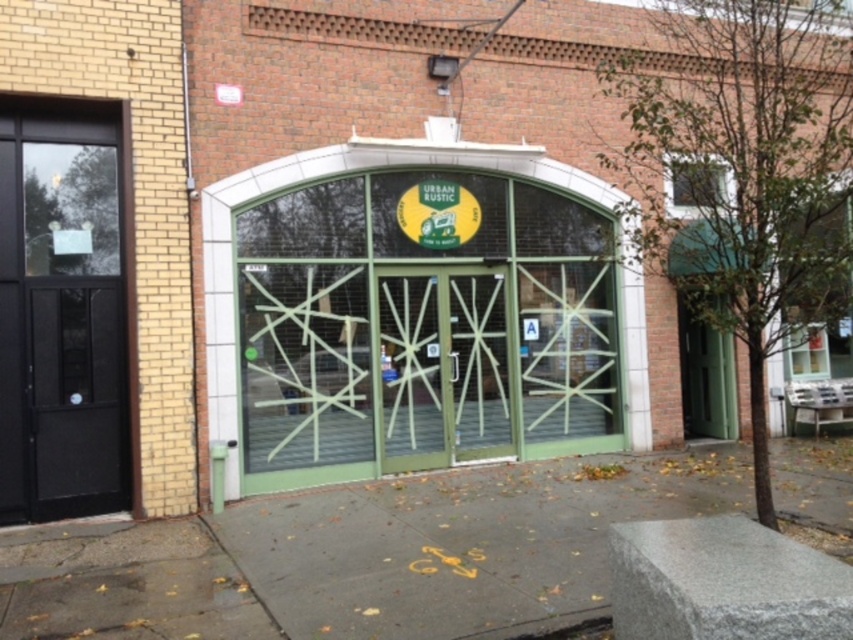
Which of these two, green matte glass door at center or black glass door at left, stands taller?

Standing taller between the two is black glass door at left.

Is point (286, 280) positioned in front of point (67, 173)?

No.

Describe the element at coordinates (418, 314) in the screenshot. This screenshot has height=640, width=853. I see `green matte glass door at center` at that location.

The image size is (853, 640). Find the location of `green matte glass door at center`. green matte glass door at center is located at coordinates (418, 314).

Which of these two, green matte glass door at center or gray concrete sidewalk at center, stands taller?

Standing taller between the two is green matte glass door at center.

Is point (407, 257) farther from viewer compared to point (402, 609)?

Yes, it is.

Between point (596, 218) and point (730, 499), which one is positioned in front?

Point (730, 499) is more forward.

I want to click on green matte glass door at center, so click(x=418, y=314).

Between green matte door at center and green matte door at right, which one appears on the left side from the viewer's perspective?

green matte door at center

Is green matte door at center to the left of green matte door at right from the viewer's perspective?

Correct, you'll find green matte door at center to the left of green matte door at right.

Locate an element on the screen. The width and height of the screenshot is (853, 640). green matte door at center is located at coordinates (444, 368).